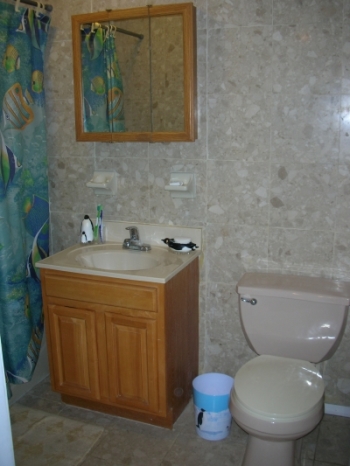
The height and width of the screenshot is (466, 350). In order to click on blue trash can in this screenshot , I will do `click(212, 403)`.